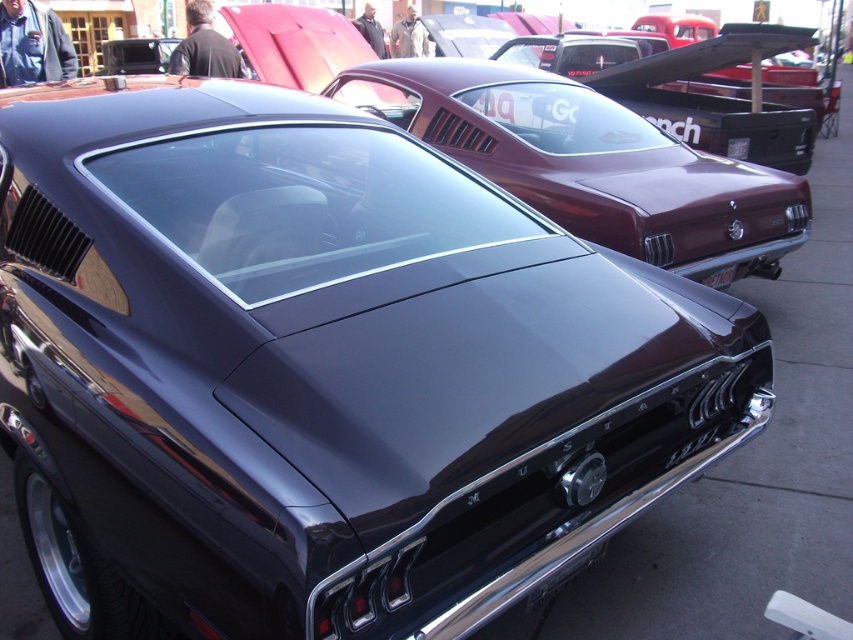
Question: Estimate the real-world distances between objects in this image. Which object is closer to the black plastic license plate at center?

Choices:
 (A) black plastic license plate at rear
 (B) glossy black car at center

Answer: (B)

Question: Which object is farther from the camera taking this photo?

Choices:
 (A) black plastic license plate at center
 (B) glossy black car at center

Answer: (B)

Question: Based on their relative distances, which object is farther from the black plastic license plate at center?

Choices:
 (A) black plastic license plate at rear
 (B) glossy black car at center

Answer: (A)

Question: Can you confirm if black plastic license plate at center is thinner than black plastic license plate at rear?

Choices:
 (A) no
 (B) yes

Answer: (A)

Question: In this image, where is glossy black car at center located relative to black plastic license plate at center?

Choices:
 (A) above
 (B) below

Answer: (A)

Question: Does glossy black car at center appear under black plastic license plate at rear?

Choices:
 (A) yes
 (B) no

Answer: (A)